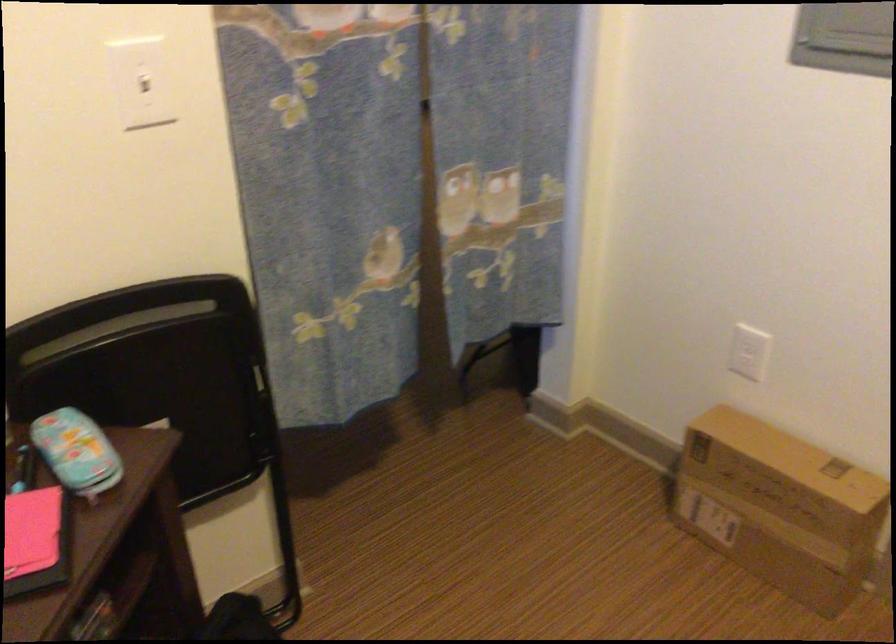
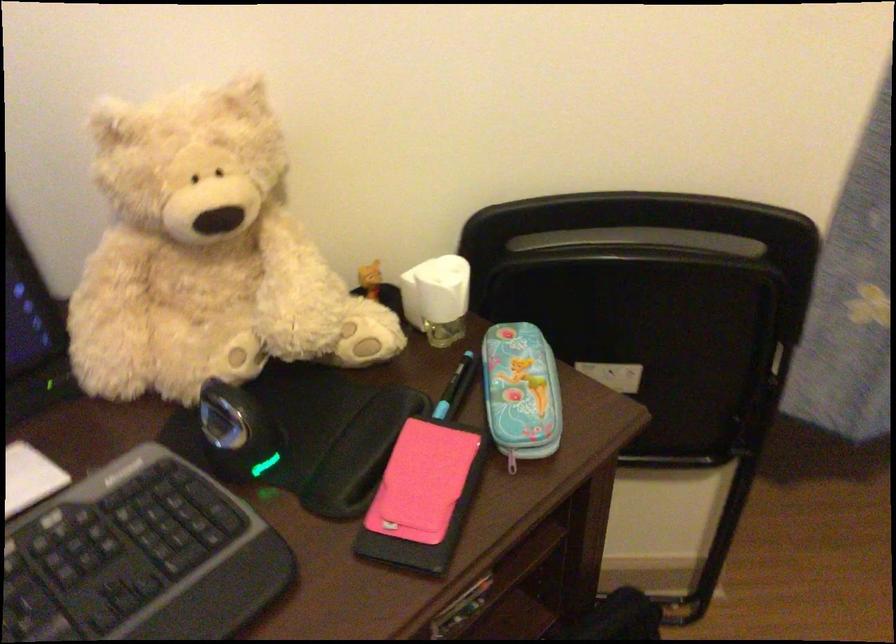
Where in the second image is the point corresponding to the point at 101,488 from the first image?

(512, 460)